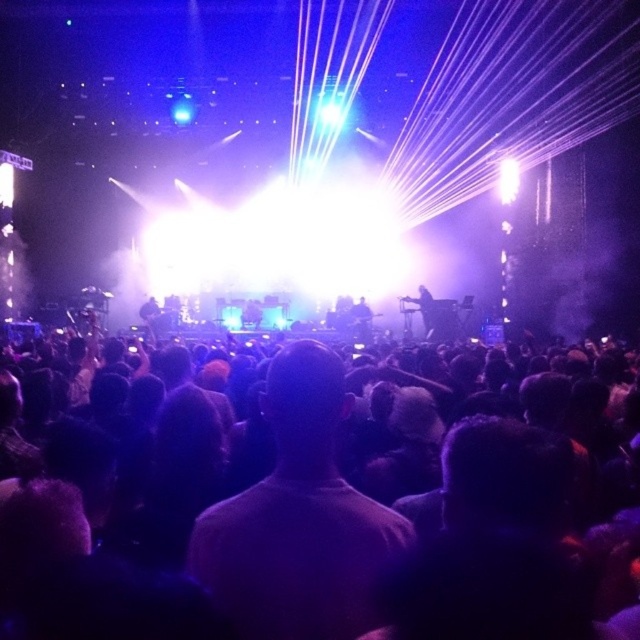
How distant is black matte crowd at center from black matte guitar at center?

The distance of black matte crowd at center from black matte guitar at center is 15.69 meters.

Between black matte crowd at center and black matte guitar at center, which one has more height?

black matte guitar at center

This screenshot has height=640, width=640. What do you see at coordinates (316, 536) in the screenshot? I see `black matte crowd at center` at bounding box center [316, 536].

This screenshot has width=640, height=640. What are the coordinates of `black matte crowd at center` in the screenshot? It's located at (316, 536).